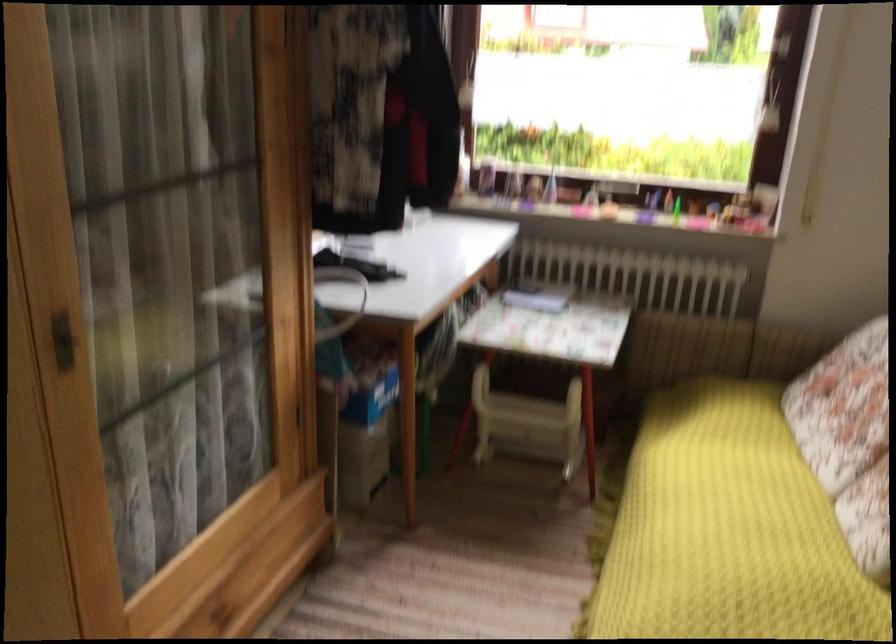
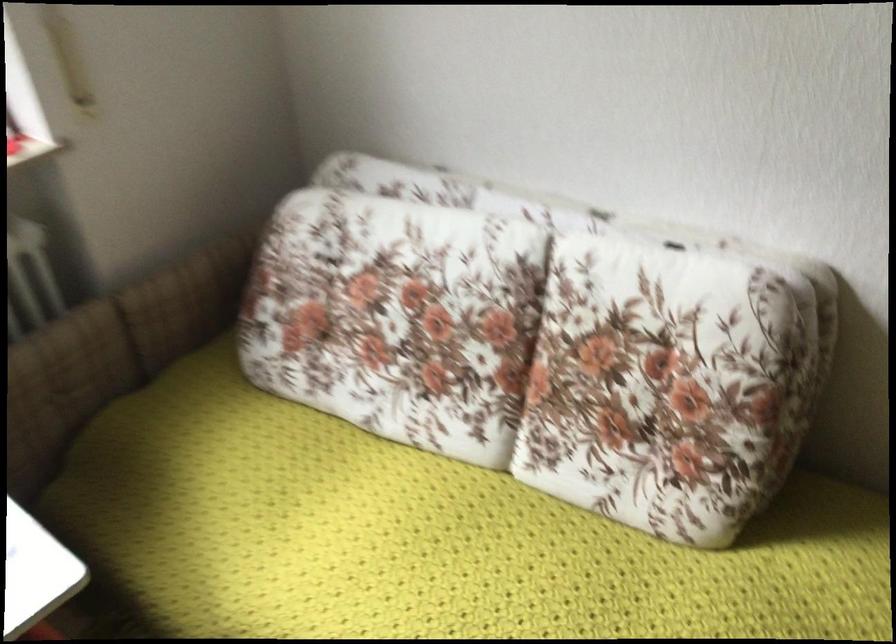
In the second image, find the point that corresponds to [699,337] in the first image.

(63, 384)